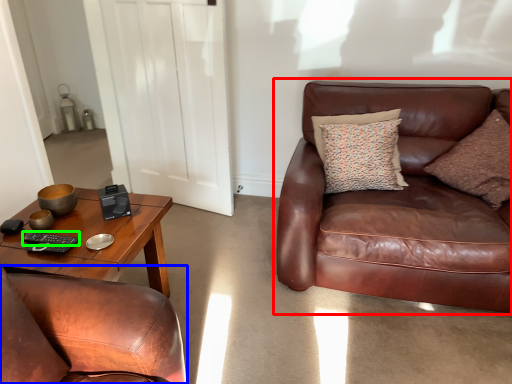
Question: Which is farther away from studio couch (highlighted by a red box)? chair (highlighted by a blue box) or remote (highlighted by a green box)?

Choices:
 (A) chair
 (B) remote

Answer: (B)